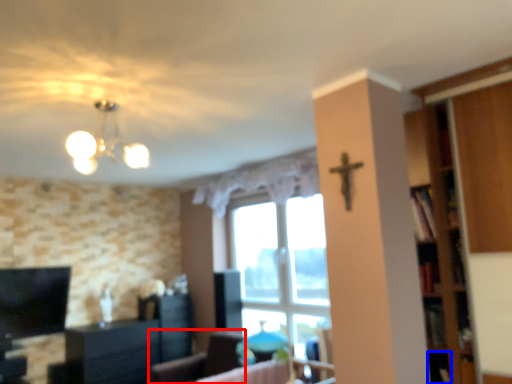
Question: Which point is further to the camera, furniture (highlighted by a red box) or shelf (highlighted by a blue box)?

Choices:
 (A) furniture
 (B) shelf

Answer: (A)